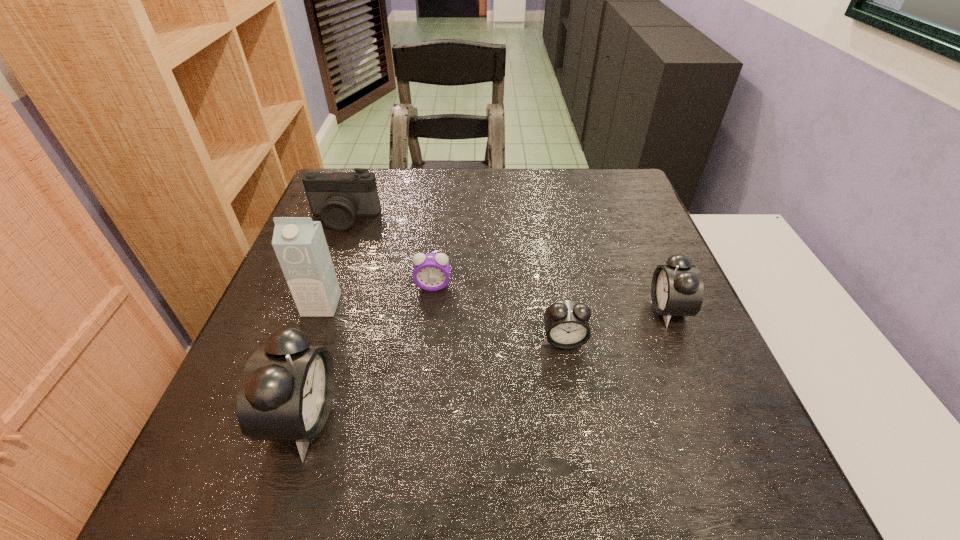
The width and height of the screenshot is (960, 540). What are the coordinates of `unoccupied area between the carton and the fourth object from left to right` in the screenshot? It's located at [377, 295].

I want to click on empty space between the nearest alarm clock and the rightmost object, so click(x=486, y=364).

Find the location of a particular element. This screenshot has width=960, height=540. vacant area that lies between the rightmost object and the camera is located at coordinates (506, 264).

Find the location of a particular element. This screenshot has width=960, height=540. free space between the leftmost alarm clock and the farthest object is located at coordinates (324, 319).

Where is `vacant space in between the farthest object and the third alarm clock from right to left`? The width and height of the screenshot is (960, 540). vacant space in between the farthest object and the third alarm clock from right to left is located at coordinates (389, 252).

I want to click on free space between the nearest object and the fourth object from left to right, so click(369, 352).

Where is `free space between the farthest object and the second object from right to left`? The height and width of the screenshot is (540, 960). free space between the farthest object and the second object from right to left is located at coordinates (454, 279).

Locate an element on the screen. Image resolution: width=960 pixels, height=540 pixels. free space between the nearest alarm clock and the camera is located at coordinates (x=324, y=319).

The image size is (960, 540). Find the location of `object that is the second closest to the rightmost object`. object that is the second closest to the rightmost object is located at coordinates (431, 272).

In order to click on object that stands as the fifth closest to the rightmost alarm clock in this screenshot , I will do `click(338, 197)`.